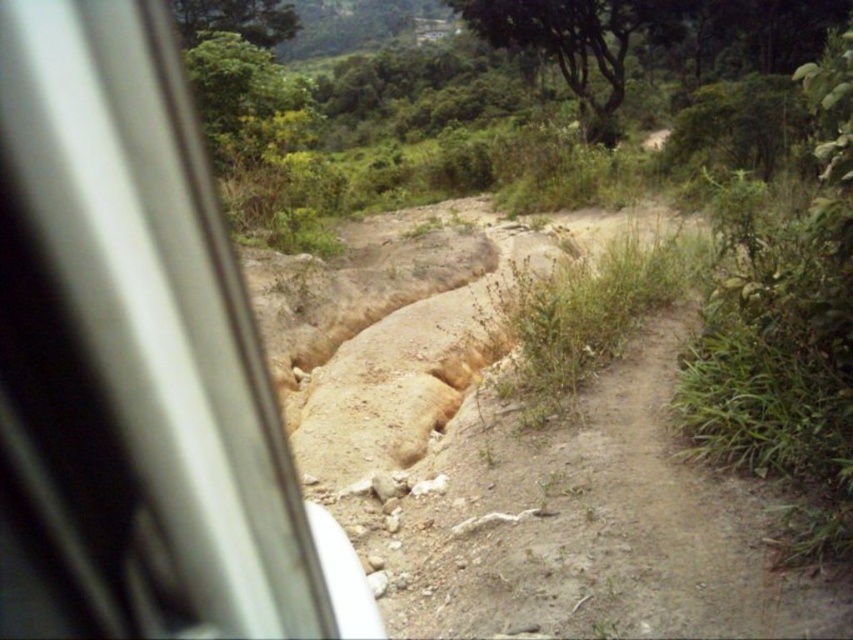
Is metallic silver train window at left wider than green leafy tree at upper left?

In fact, metallic silver train window at left might be narrower than green leafy tree at upper left.

Based on the photo, does metallic silver train window at left appear on the right side of green leafy tree at upper left?

Indeed, metallic silver train window at left is positioned on the right side of green leafy tree at upper left.

Measure the distance between metallic silver train window at left and camera.

metallic silver train window at left is 70.36 centimeters away from camera.

Image resolution: width=853 pixels, height=640 pixels. I want to click on metallic silver train window at left, so click(x=131, y=355).

Which is behind, point (0, 120) or point (598, 44)?

Point (598, 44)

You are a GUI agent. You are given a task and a screenshot of the screen. Output one action in this format:
    pyautogui.click(x=<x>, y=<y>)
    Task: Click on the metallic silver train window at left
    
    Given the screenshot: What is the action you would take?
    pyautogui.click(x=131, y=355)

Between green leafy tree at upper center and green leafy tree at upper left, which one has less height?

With less height is green leafy tree at upper left.

Is green leafy tree at upper center below green leafy tree at upper left?

No.

Locate an element on the screen. The width and height of the screenshot is (853, 640). green leafy tree at upper center is located at coordinates (579, 42).